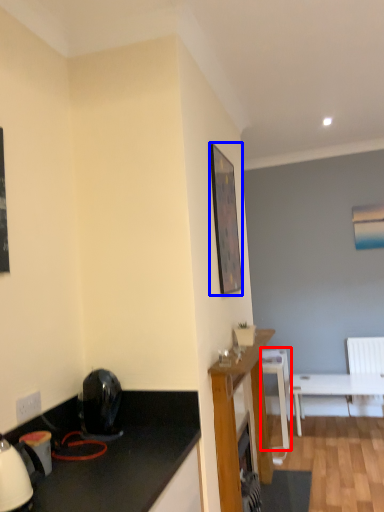
Question: Which of the following is the farthest to the observer, chair (highlighted by a red box) or picture frame (highlighted by a blue box)?

Choices:
 (A) chair
 (B) picture frame

Answer: (A)